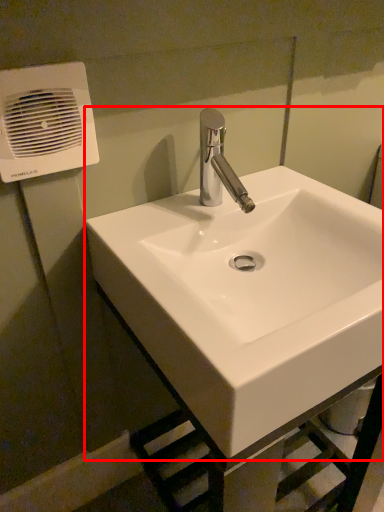
Question: From the image's perspective, what is the correct spatial relationship of sink (annotated by the red box) in relation to air conditioning?

Choices:
 (A) above
 (B) below

Answer: (B)